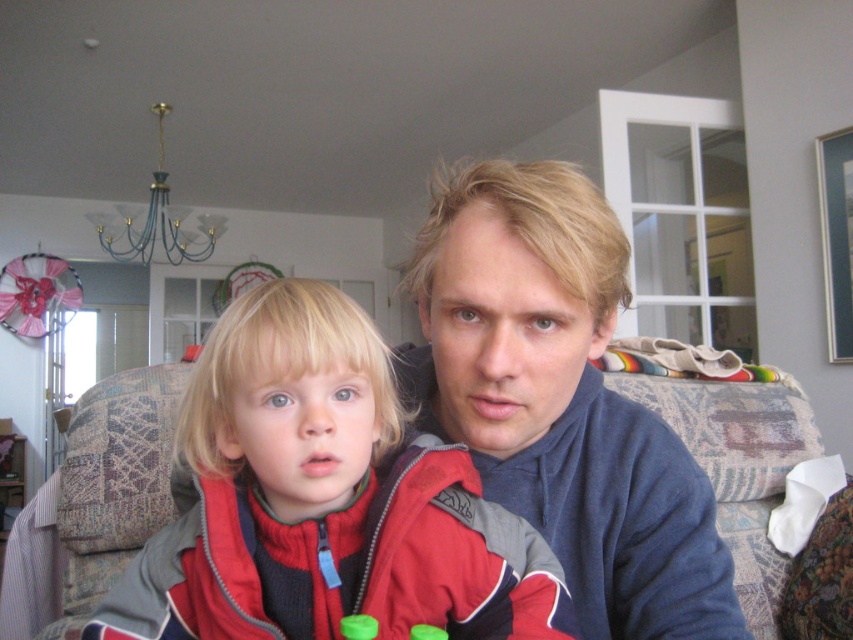
Consider the image. You are a photographer standing in front of the matte red jacket at center. You want to take a clear photo of it without any blur. Considering the camera requires a minimum distance of 24 inches to focus properly, will you need to move closer or farther away?

The distance between the matte red jacket at center and the camera is 20.48 inches, which is less than the required 24 inches. Therefore, you need to move farther away to achieve a clear, nonblurry photo.

You are designing a storage system for a closet. You have two items to store vertically on the same shelf. The matte red jacket at center and the blue fleece at center. Given that the shelf has limited vertical space, which item should you place first to ensure both can fit?

The matte red jacket at center has a lesser height compared to the blue fleece at center. Therefore, place the taller blue fleece at center first, then the shorter matte red jacket at center to ensure both can fit on the shelf.